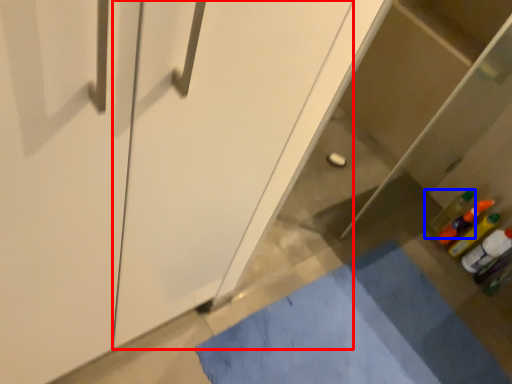
Question: Which object is closer to the camera taking this photo, screen door (highlighted by a red box) or bottle (highlighted by a blue box)?

Choices:
 (A) screen door
 (B) bottle

Answer: (A)